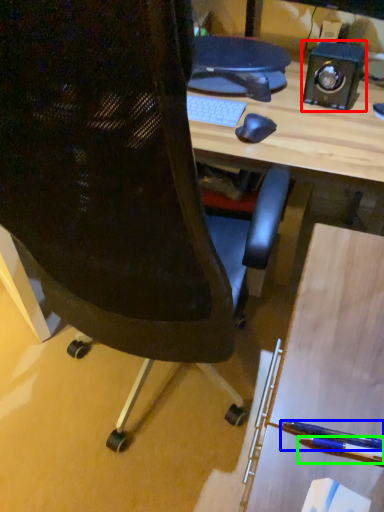
Question: Which object is positioned closest to speaker (highlighted by a red box)? Select from penguin (highlighted by a blue box) and pencil (highlighted by a green box).

Choices:
 (A) penguin
 (B) pencil

Answer: (A)